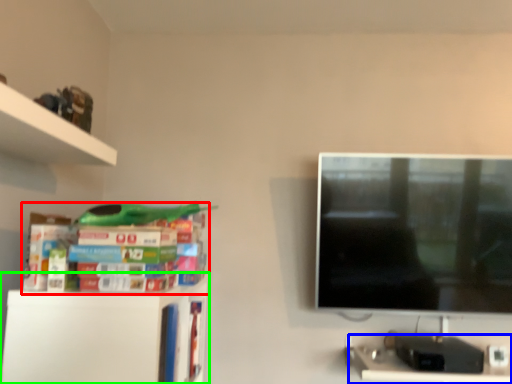
Question: Considering the real-world distances, which object is closest to book (highlighted by a red box)? computer desk (highlighted by a blue box) or shelf (highlighted by a green box).

Choices:
 (A) computer desk
 (B) shelf

Answer: (B)